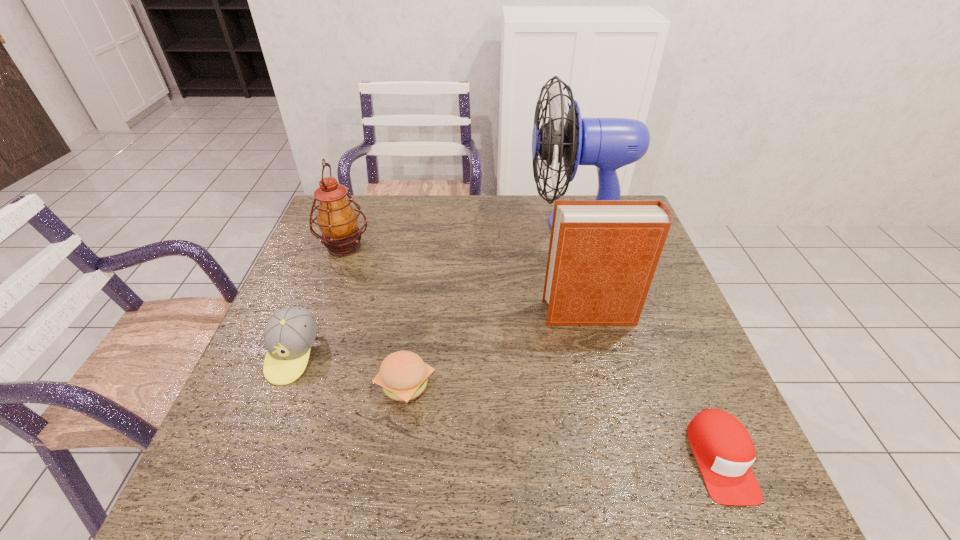
Where is `vacant space located in front of the tallest object where the airflow is directed`? The height and width of the screenshot is (540, 960). vacant space located in front of the tallest object where the airflow is directed is located at coordinates (409, 224).

At what (x,y) coordinates should I click in order to perform the action: click on free point located 0.290m on the open cover of the hardback book. Please return your answer as a coordinate pair (x, y). This screenshot has width=960, height=540. Looking at the image, I should click on (431, 313).

Image resolution: width=960 pixels, height=540 pixels. I want to click on blank space located 0.230m on the open cover of the hardback book, so click(x=454, y=313).

Find the location of `vacant space situated 0.120m on the open cover of the hardback book`. vacant space situated 0.120m on the open cover of the hardback book is located at coordinates (497, 313).

The image size is (960, 540). What are the coordinates of `free space located 0.190m on the right of the oil lamp` in the screenshot? It's located at (434, 247).

The image size is (960, 540). In order to click on vacant space located 0.250m on the front-facing side of the taller baseball cap in this screenshot , I will do `click(233, 505)`.

This screenshot has width=960, height=540. Identify the location of vacant space positioned 0.120m on the right of the hamburger. (490, 384).

Find the location of a particular element. This screenshot has height=540, width=960. fan that is at the far edge is located at coordinates (608, 143).

In order to click on oil lamp at the far edge in this screenshot , I will do `click(337, 220)`.

At what (x,y) coordinates should I click in order to perform the action: click on object at the near edge. Please return your answer as a coordinate pair (x, y). Image resolution: width=960 pixels, height=540 pixels. Looking at the image, I should click on (724, 451).